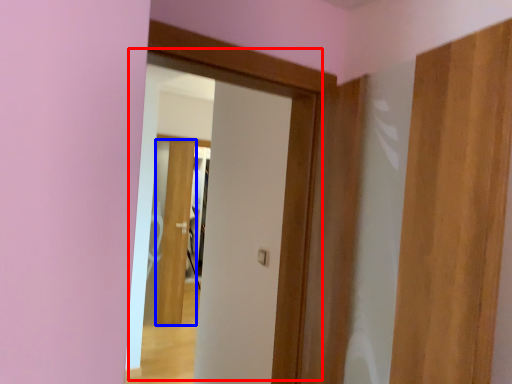
Question: Which object appears closest to the camera in this image, door (highlighted by a red box) or door (highlighted by a blue box)?

Choices:
 (A) door
 (B) door

Answer: (A)